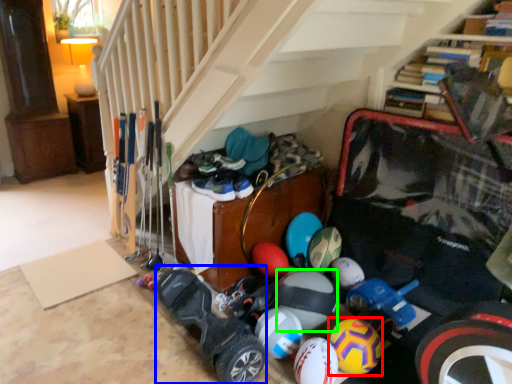
Question: Based on their relative distances, which object is nearer to bowling ball (highlighted by a red box)? Choose from wide (highlighted by a blue box) and beach ball (highlighted by a green box).

Choices:
 (A) wide
 (B) beach ball

Answer: (B)